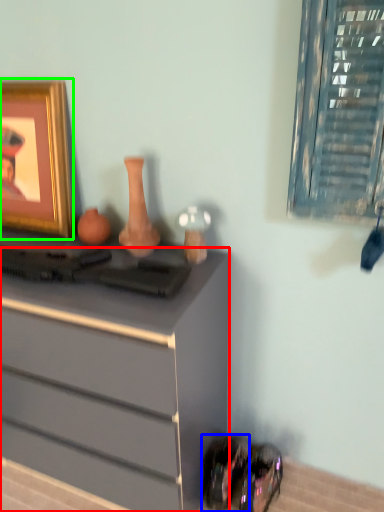
Question: Which object is the closest to the chest of drawers (highlighted by a red box)? Choose among these: shoe (highlighted by a blue box) or picture frame (highlighted by a green box).

Choices:
 (A) shoe
 (B) picture frame

Answer: (A)